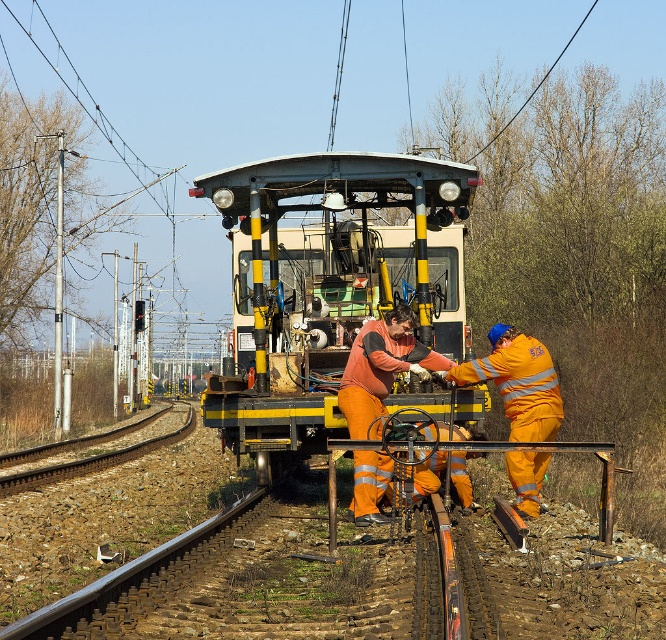
Question: Which of the following is the farthest from the observer?

Choices:
 (A) orange reflective rail at center
 (B) metallic yellow train at center

Answer: (B)

Question: Is metallic yellow train at center further to the viewer compared to orange reflective rail at center?

Choices:
 (A) no
 (B) yes

Answer: (B)

Question: Is metallic yellow train at center further to camera compared to orange reflective rail at center?

Choices:
 (A) yes
 (B) no

Answer: (A)

Question: Is metallic yellow train at center further to the viewer compared to orange reflective rail at center?

Choices:
 (A) yes
 (B) no

Answer: (A)

Question: Among these objects, which one is nearest to the camera?

Choices:
 (A) orange reflective rail at center
 (B) metallic yellow train at center

Answer: (A)